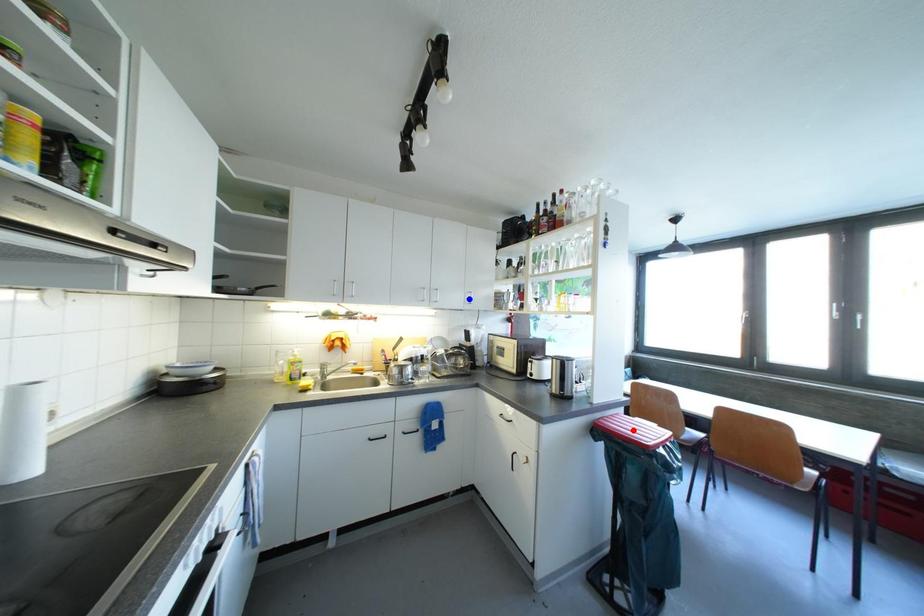
Question: Which of the two points in the image is closer to the camera?

Choices:
 (A) Blue point is closer.
 (B) Red point is closer.

Answer: (B)